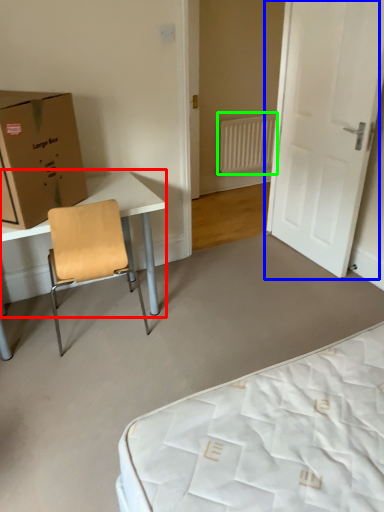
Question: Which is nearer to the table (highlighted by a red box)? door (highlighted by a blue box) or radiator (highlighted by a green box).

Choices:
 (A) door
 (B) radiator

Answer: (A)